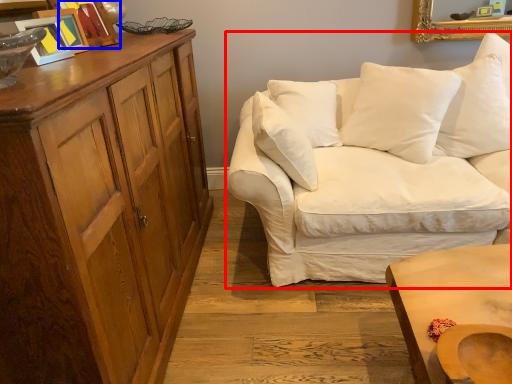
Question: Among these objects, which one is nearest to the camera, studio couch (highlighted by a red box) or picture frame (highlighted by a blue box)?

Choices:
 (A) studio couch
 (B) picture frame

Answer: (A)